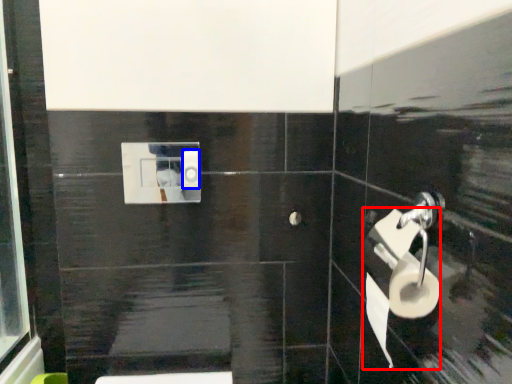
Question: Among these objects, which one is farthest to the camera, toilet paper (highlighted by a red box) or toilet paper (highlighted by a blue box)?

Choices:
 (A) toilet paper
 (B) toilet paper

Answer: (B)